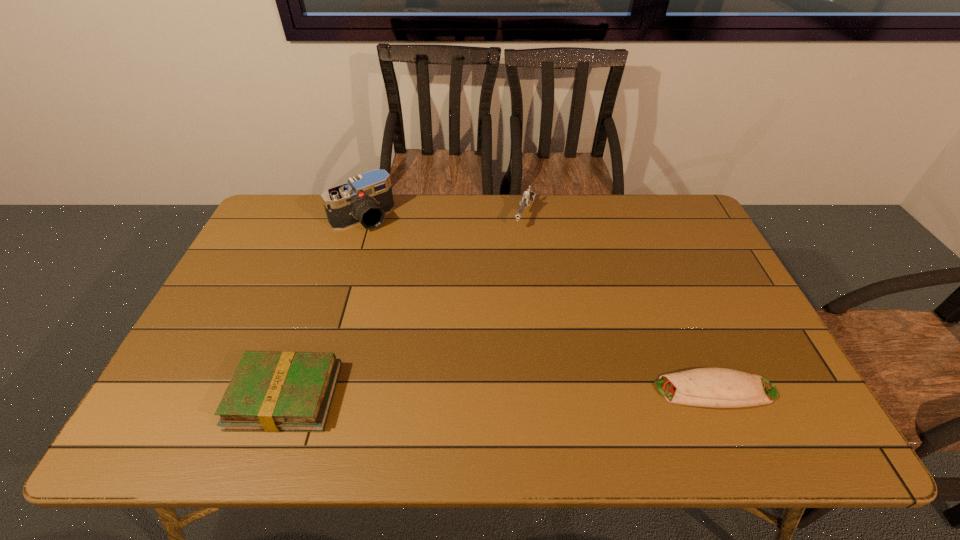
Where is `object positioned at the right edge`? object positioned at the right edge is located at coordinates (704, 387).

Identify the location of object that is at the near right corner. (704, 387).

Image resolution: width=960 pixels, height=540 pixels. Identify the location of free region at the far edge of the desktop. (438, 204).

This screenshot has height=540, width=960. What are the coordinates of `blank area at the near edge` in the screenshot? It's located at (427, 404).

This screenshot has height=540, width=960. In the image, there is a desktop. What are the coordinates of `blank space at the left edge` in the screenshot? It's located at (274, 255).

At what (x,y) coordinates should I click in order to perform the action: click on vacant region at the right edge. Please return your answer as a coordinate pair (x, y). The image size is (960, 540). Looking at the image, I should click on (721, 282).

In order to click on vacant space that's between the book and the gun in this screenshot , I will do `click(405, 305)`.

Locate an element on the screen. This screenshot has width=960, height=540. vacant space that's between the book and the shortest object is located at coordinates click(500, 393).

Find the location of `free space between the second shortest object and the camera`. free space between the second shortest object and the camera is located at coordinates (324, 307).

Find the location of a particular element. This screenshot has width=960, height=540. empty space between the book and the second tallest object is located at coordinates (x=405, y=305).